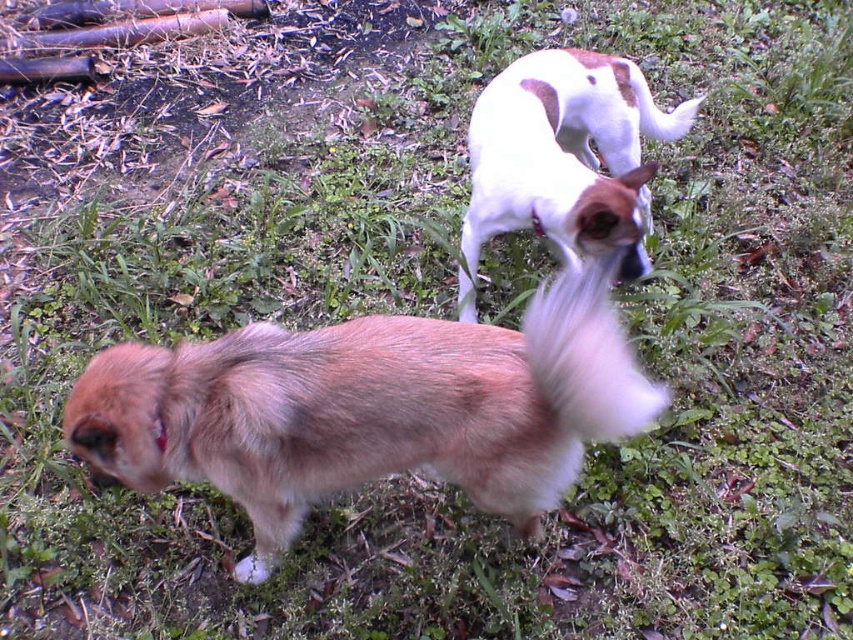
Question: Is white smooth dog at upper right closer to the viewer compared to white fluffy tail at upper right?

Choices:
 (A) yes
 (B) no

Answer: (A)

Question: Which point is farther from the camera taking this photo?

Choices:
 (A) (221, 378)
 (B) (637, 115)
 (C) (573, 362)
 (D) (525, 205)

Answer: (B)

Question: Among these objects, which one is nearest to the camera?

Choices:
 (A) white smooth dog at upper right
 (B) white fluffy tail at upper right
 (C) light brown fur dog at center
 (D) white fluffy tail at center

Answer: (D)

Question: Does light brown fur dog at center appear over white smooth dog at upper right?

Choices:
 (A) no
 (B) yes

Answer: (A)

Question: Can you confirm if light brown fur dog at center is positioned to the left of white fluffy tail at upper right?

Choices:
 (A) yes
 (B) no

Answer: (A)

Question: Among these objects, which one is farthest from the camera?

Choices:
 (A) white smooth dog at upper right
 (B) white fluffy tail at center
 (C) light brown fur dog at center

Answer: (A)